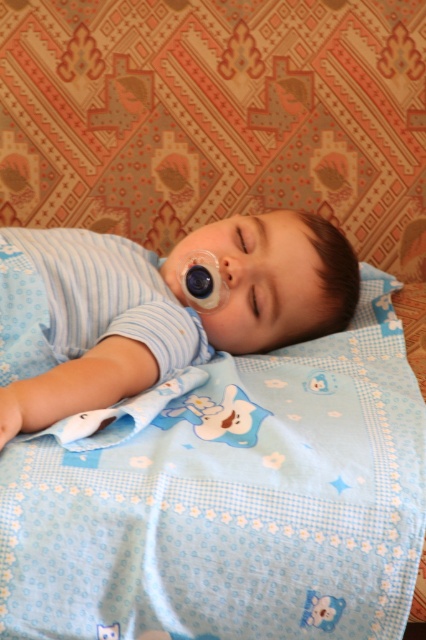
Is blue fabric blanket at center wider than blue soft fabric at center?

Yes.

Can you confirm if blue fabric blanket at center is positioned to the left of blue soft fabric at center?

In fact, blue fabric blanket at center is to the right of blue soft fabric at center.

Is point (92, 556) more distant than point (314, 252)?

No.

Where is `blue fabric blanket at center`? This screenshot has width=426, height=640. blue fabric blanket at center is located at coordinates (229, 499).